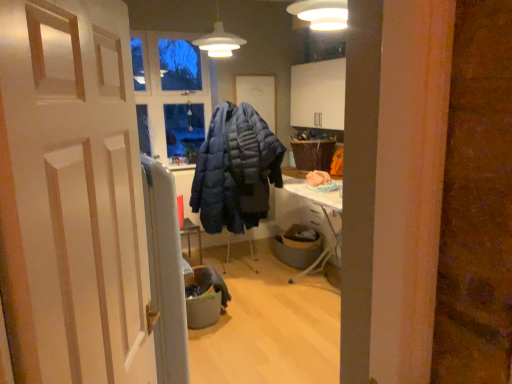
The image size is (512, 384). What are the coordinates of `space that is in front of gray fabric trash bin at center, which is the 1th trash bin/can from back to front` in the screenshot? It's located at (290, 276).